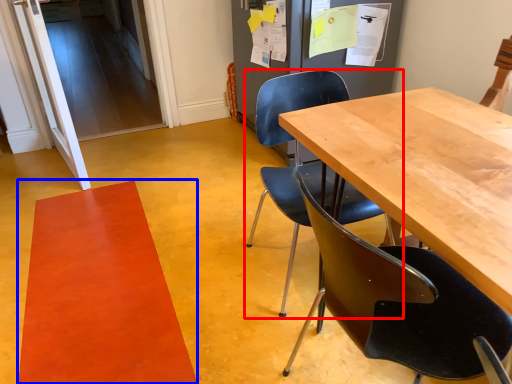
Question: Which object appears farthest to the camera in this image, chair (highlighted by a red box) or mat (highlighted by a blue box)?

Choices:
 (A) chair
 (B) mat

Answer: (B)